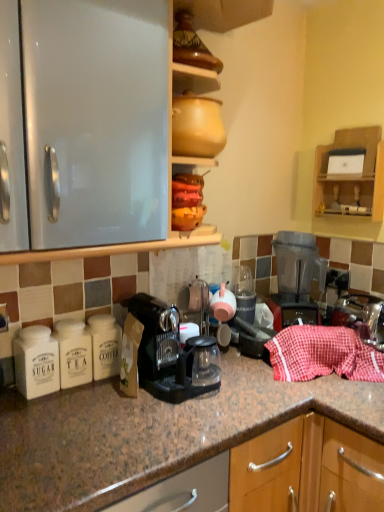
Question: In terms of size, does black plastic coffee machine at center appear bigger or smaller than transparent plastic blender at right?

Choices:
 (A) small
 (B) big

Answer: (A)

Question: From the image's perspective, is black plastic coffee machine at center above or below transparent plastic blender at right?

Choices:
 (A) above
 (B) below

Answer: (B)

Question: Which object is positioned closest to the wooden shelf at upper right?

Choices:
 (A) transparent plastic blender at right
 (B) black plastic coffee machine at center
 (C) matte glass tea pot at center
 (D) red checkered cloth at right

Answer: (A)

Question: Which is nearer to the matte glass tea pot at center?

Choices:
 (A) black plastic coffee machine at center
 (B) transparent plastic blender at right
 (C) red checkered cloth at right
 (D) wooden shelf at upper right

Answer: (A)